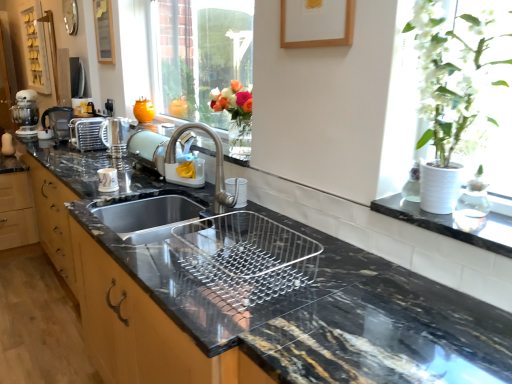
Question: Are satin nickel kettle at center, the 1th appliance positioned from the right, and black marble sink at center far apart?

Choices:
 (A) no
 (B) yes

Answer: (B)

Question: Can you confirm if satin nickel kettle at center, the 1th appliance positioned from the right, is taller than black marble sink at center?

Choices:
 (A) no
 (B) yes

Answer: (A)

Question: From a real-world perspective, is satin nickel kettle at center, the 2th appliance from the left, located beneath black marble sink at center?

Choices:
 (A) yes
 (B) no

Answer: (B)

Question: Does satin nickel kettle at center, the second appliance in the back-to-front sequence, come in front of black marble sink at center?

Choices:
 (A) no
 (B) yes

Answer: (A)

Question: Is satin nickel kettle at center, the 1th appliance viewed from the front, further to camera compared to black marble sink at center?

Choices:
 (A) no
 (B) yes

Answer: (B)

Question: Does satin nickel kettle at center, the second appliance in the back-to-front sequence, have a smaller size compared to black marble sink at center?

Choices:
 (A) yes
 (B) no

Answer: (A)

Question: Is satin nickel kettle at center, the 1th appliance positioned from the right, looking in the opposite direction of white matte vase at upper right?

Choices:
 (A) no
 (B) yes

Answer: (A)

Question: Is there a large distance between satin nickel kettle at center, the second appliance in the back-to-front sequence, and white matte vase at upper right?

Choices:
 (A) no
 (B) yes

Answer: (B)

Question: From a real-world perspective, does satin nickel kettle at center, the second appliance in the back-to-front sequence, stand above white matte vase at upper right?

Choices:
 (A) no
 (B) yes

Answer: (A)

Question: Is satin nickel kettle at center, the 1th appliance viewed from the front, located outside white matte vase at upper right?

Choices:
 (A) no
 (B) yes

Answer: (B)

Question: Is satin nickel kettle at center, the 1th appliance positioned from the right, wider than white matte vase at upper right?

Choices:
 (A) yes
 (B) no

Answer: (B)

Question: Considering the relative positions of satin nickel kettle at center, the second appliance in the back-to-front sequence, and white matte vase at upper right in the image provided, is satin nickel kettle at center, the second appliance in the back-to-front sequence, to the right of white matte vase at upper right from the viewer's perspective?

Choices:
 (A) yes
 (B) no

Answer: (B)

Question: Can you confirm if metallic silver toaster at upper left, which is the second appliance from front to back, is smaller than orange matte vase at upper center?

Choices:
 (A) no
 (B) yes

Answer: (A)